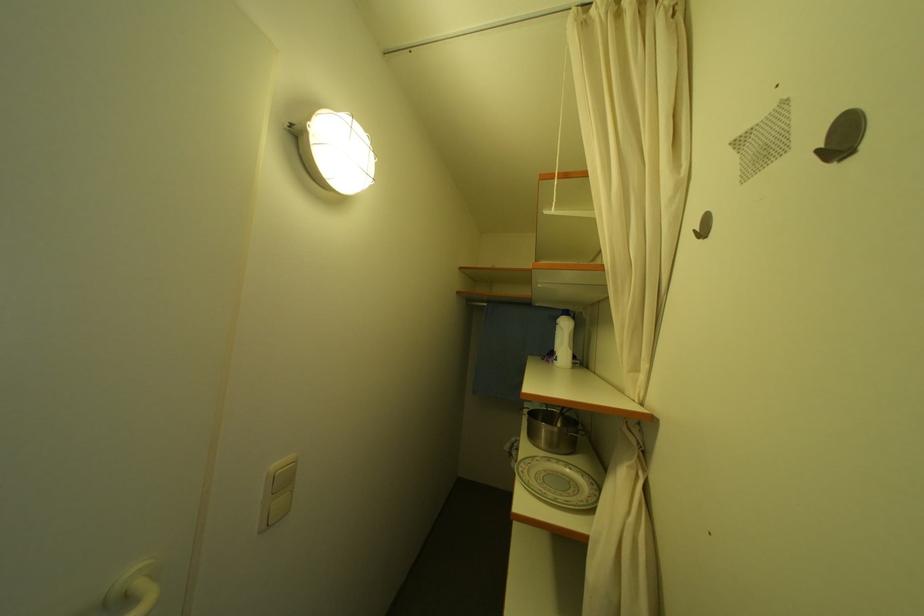
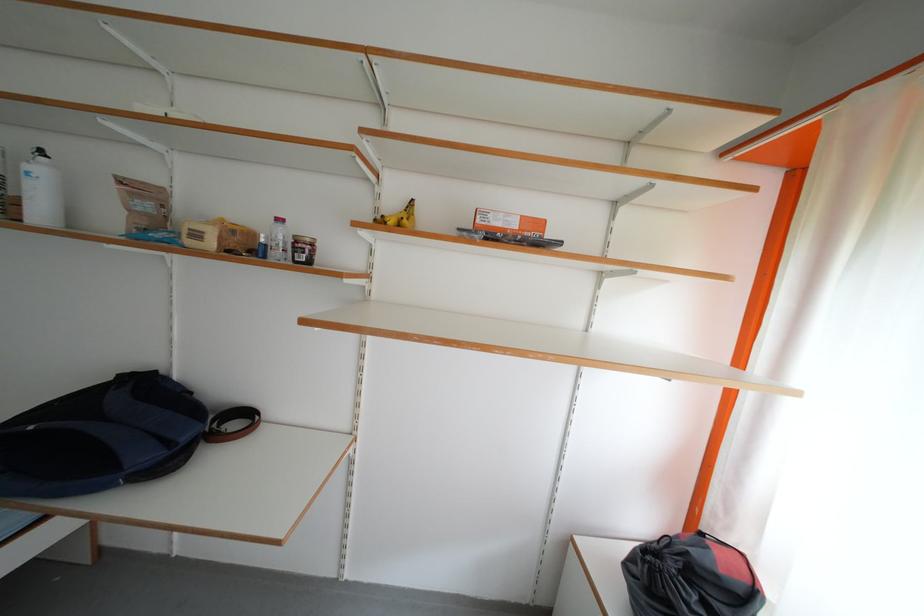
Question: The images are taken continuously from a first-person perspective. In which direction are you moving?

Choices:
 (A) Left
 (B) Right
 (C) Forward
 (D) Backward

Answer: (B)